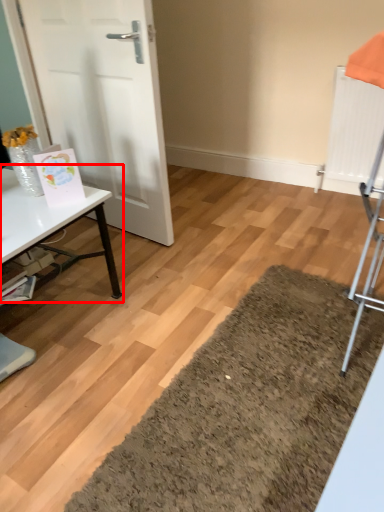
Question: From the image's perspective, where is table (annotated by the red box) located in relation to door in the image?

Choices:
 (A) below
 (B) above

Answer: (A)